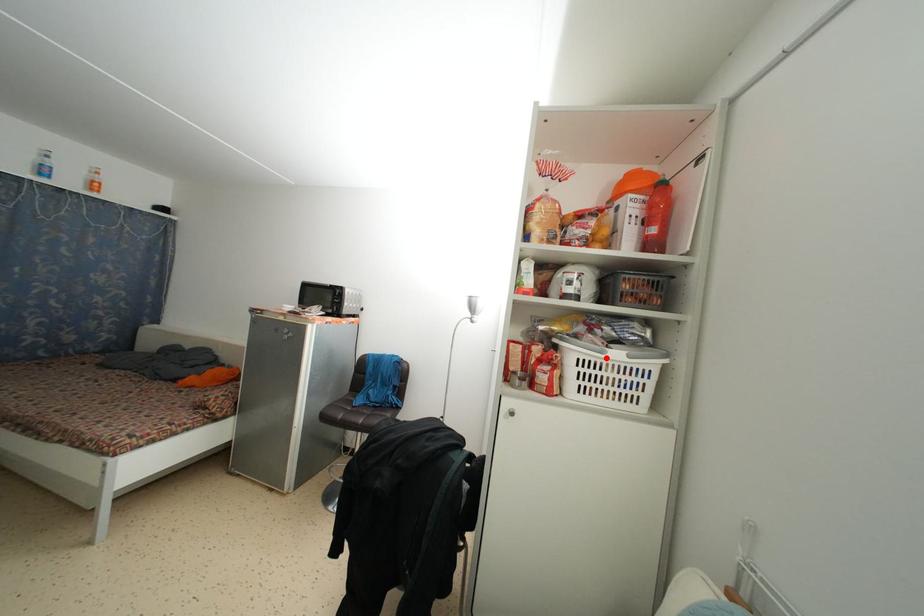
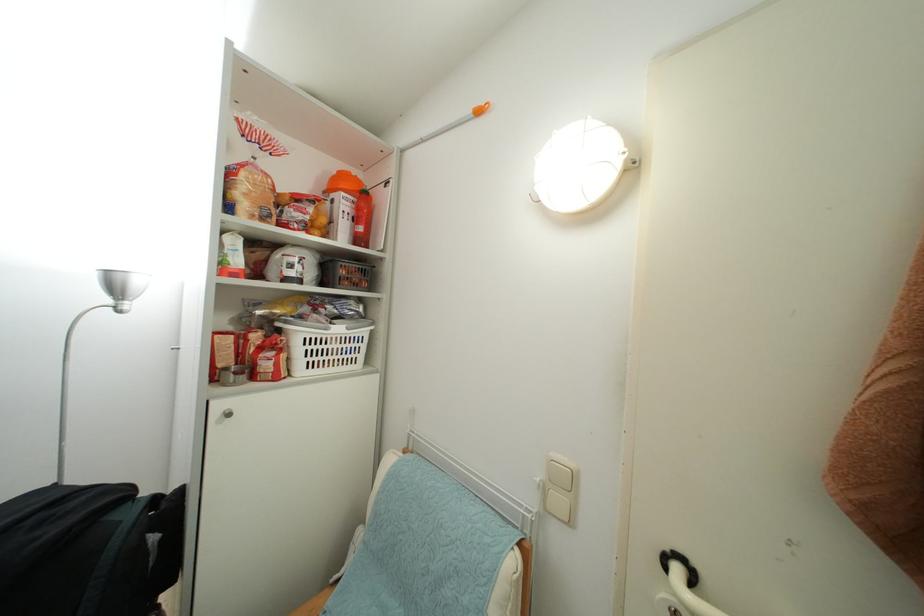
The point at the highlighted location is marked in the first image. Where is the corresponding point in the second image?

(331, 334)